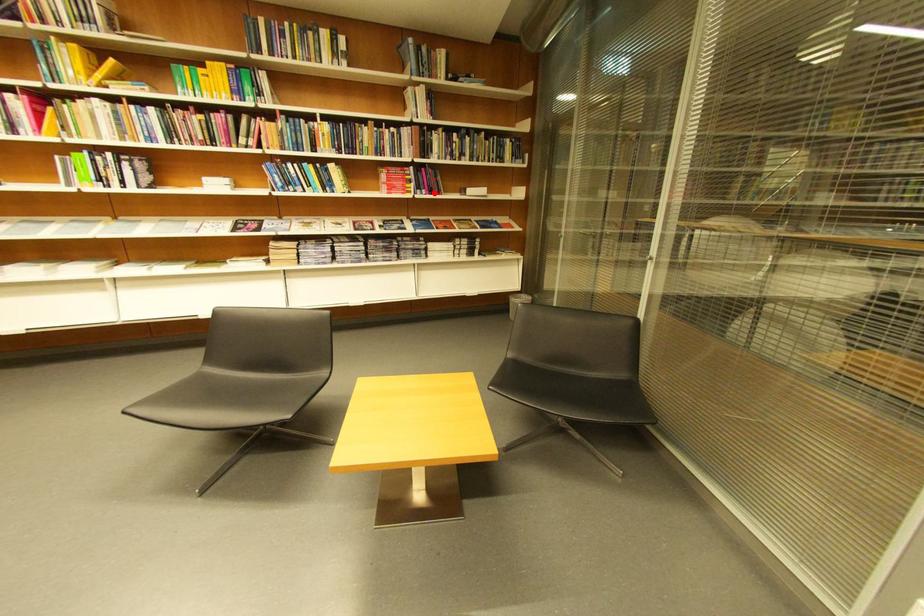
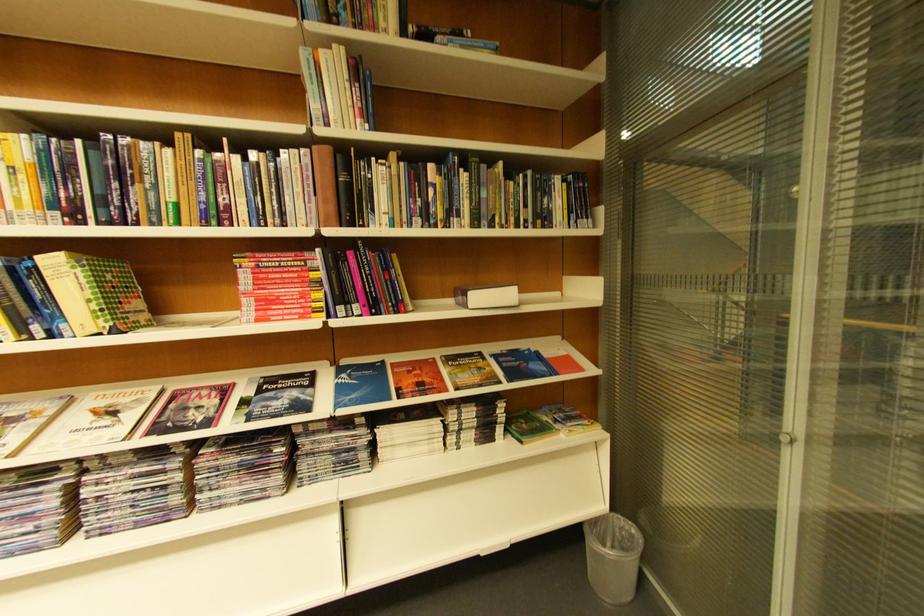
Question: I am providing you with two images of the same scene from different viewpoints. In image1, a red point is highlighted. Considering the same 3D point in image2, which of the following is correct?

Choices:
 (A) It is closer
 (B) It is farther

Answer: (B)